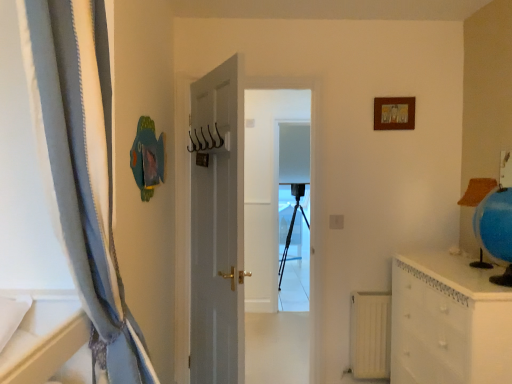
Question: Is metallic hooks at center at the right side of black matte tripod at center?

Choices:
 (A) no
 (B) yes

Answer: (A)

Question: Is metallic hooks at center closer to the viewer compared to black matte tripod at center?

Choices:
 (A) yes
 (B) no

Answer: (A)

Question: Is metallic hooks at center thinner than black matte tripod at center?

Choices:
 (A) no
 (B) yes

Answer: (B)

Question: Is metallic hooks at center not close to black matte tripod at center?

Choices:
 (A) no
 (B) yes

Answer: (B)

Question: From the image's perspective, would you say metallic hooks at center is positioned over black matte tripod at center?

Choices:
 (A) yes
 (B) no

Answer: (A)

Question: From the image's perspective, is white matte radiator at lower right positioned above or below metallic hooks at center?

Choices:
 (A) below
 (B) above

Answer: (A)

Question: Considering the relative positions of white matte radiator at lower right and metallic hooks at center in the image provided, is white matte radiator at lower right to the left or to the right of metallic hooks at center?

Choices:
 (A) right
 (B) left

Answer: (A)

Question: Is white matte radiator at lower right situated inside metallic hooks at center or outside?

Choices:
 (A) outside
 (B) inside

Answer: (A)

Question: From their relative heights in the image, would you say white matte radiator at lower right is taller or shorter than metallic hooks at center?

Choices:
 (A) short
 (B) tall

Answer: (B)

Question: Looking at their shapes, would you say black matte tripod at center is wider or thinner than metallic hooks at center?

Choices:
 (A) thin
 (B) wide

Answer: (B)

Question: Is point (278, 299) closer or farther from the camera than point (212, 140)?

Choices:
 (A) farther
 (B) closer

Answer: (A)

Question: Do you think black matte tripod at center is within metallic hooks at center, or outside of it?

Choices:
 (A) inside
 (B) outside

Answer: (B)

Question: Based on their positions, is black matte tripod at center located to the left or right of metallic hooks at center?

Choices:
 (A) left
 (B) right

Answer: (B)

Question: From the image's perspective, is white glossy chest of drawers at right located above or below white matte radiator at lower right?

Choices:
 (A) above
 (B) below

Answer: (A)

Question: From a real-world perspective, is white glossy chest of drawers at right physically located above or below white matte radiator at lower right?

Choices:
 (A) below
 (B) above

Answer: (B)